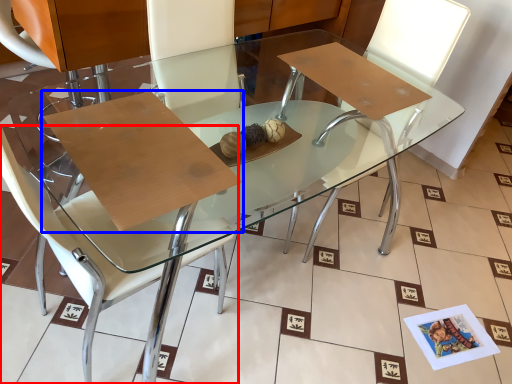
Question: Which point is further to the camera, chair (highlighted by a red box) or cardboard (highlighted by a blue box)?

Choices:
 (A) chair
 (B) cardboard

Answer: (B)